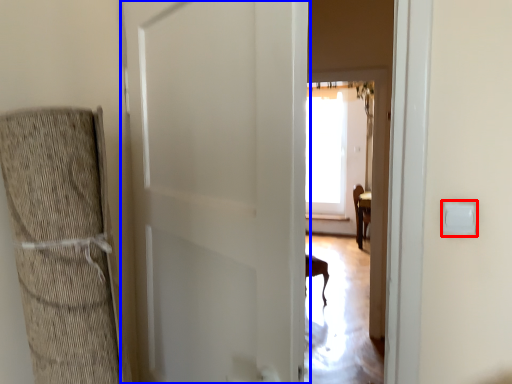
Question: Which object is closer to the camera taking this photo, light switch (highlighted by a red box) or door (highlighted by a blue box)?

Choices:
 (A) light switch
 (B) door

Answer: (B)